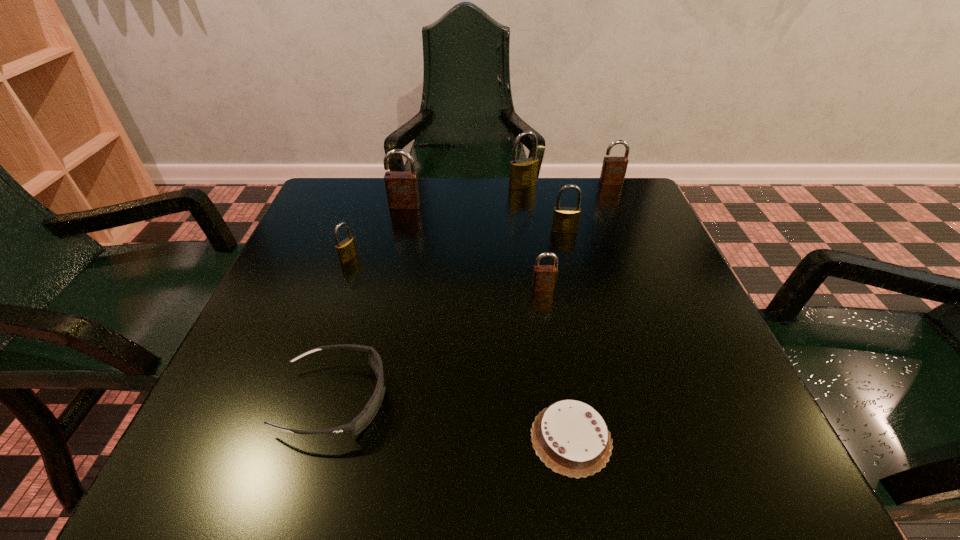
Image resolution: width=960 pixels, height=540 pixels. I want to click on blank space located 0.160m on the front-facing side of the smallest brown padlock, so click(x=554, y=357).

Locate an element on the screen. The image size is (960, 540). free space located on the lenses of the goggles is located at coordinates [433, 400].

Identify the location of free space located 0.180m on the back of the chocolate cake. (551, 317).

The height and width of the screenshot is (540, 960). I want to click on goggles situated at the near edge, so click(359, 423).

In order to click on chocolate cake that is at the near edge in this screenshot , I will do `click(570, 437)`.

This screenshot has height=540, width=960. Identify the location of padlock that is positioned at the left edge. (346, 250).

Locate an element on the screen. goggles located in the left edge section of the desktop is located at coordinates (359, 423).

Locate an element on the screen. The width and height of the screenshot is (960, 540). object present at the right edge is located at coordinates (613, 171).

The image size is (960, 540). Find the location of `object that is at the near left corner`. object that is at the near left corner is located at coordinates (359, 423).

Locate an element on the screen. Image resolution: width=960 pixels, height=540 pixels. object that is positioned at the far right corner is located at coordinates (613, 171).